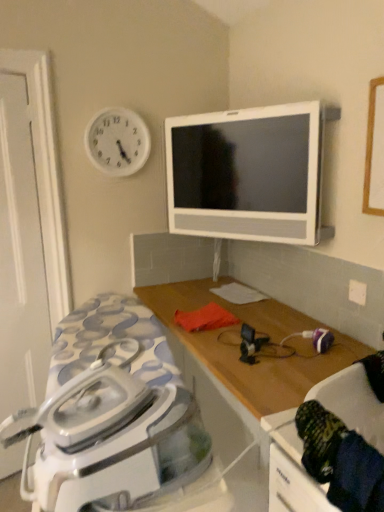
What do you see at coordinates (247, 173) in the screenshot? The image size is (384, 512). I see `white glossy television at upper center` at bounding box center [247, 173].

Measure the distance between white plastic clock at upper left and camera.

7.05 feet.

Image resolution: width=384 pixels, height=512 pixels. I want to click on white plastic clock at upper left, so click(x=117, y=142).

Where is `white matte door at left`? The height and width of the screenshot is (512, 384). white matte door at left is located at coordinates (25, 228).

Image resolution: width=384 pixels, height=512 pixels. What are the coordinates of `white glossy television at upper center` in the screenshot? It's located at (247, 173).

Is white matte door at left completely or partially inside wooden table at center?

No.

Is wooden table at center wider than white matte door at left?

Yes, wooden table at center is wider than white matte door at left.

Is wooden table at center positioned in front of white matte door at left?

Yes, the depth of wooden table at center is less than that of white matte door at left.

From the image's perspective, is wooden table at center positioned above or below white matte door at left?

wooden table at center is below white matte door at left.

This screenshot has height=512, width=384. In order to click on home appliance behind the dark blue fabric swivel chair at lower right in this screenshot , I will do `click(116, 421)`.

From the picture: Which of these two, white glossy iron at lower left or dark blue fabric swivel chair at lower right, stands shorter?

With less height is dark blue fabric swivel chair at lower right.

Is white glossy iron at lower left with dark blue fabric swivel chair at lower right?

They are not placed beside each other.

Considering the sizes of objects white glossy iron at lower left and dark blue fabric swivel chair at lower right in the image provided, who is thinner, white glossy iron at lower left or dark blue fabric swivel chair at lower right?

dark blue fabric swivel chair at lower right.

In the scene shown: Which object is positioned more to the left, white glossy iron at lower left or white glossy television at upper center?

white glossy iron at lower left.

Consider the image. Considering the sizes of objects white glossy iron at lower left and white glossy television at upper center in the image provided, who is taller, white glossy iron at lower left or white glossy television at upper center?

With more height is white glossy television at upper center.

Is point (202, 465) farther from viewer compared to point (258, 152)?

No, (202, 465) is closer to viewer.

Between dark blue fabric swivel chair at lower right and white matte door at left, which one appears on the left side from the viewer's perspective?

white matte door at left.

From a real-world perspective, relative to white matte door at left, is dark blue fabric swivel chair at lower right vertically above or below?

Clearly, from a real-world perspective, dark blue fabric swivel chair at lower right is below white matte door at left.

Who is bigger, dark blue fabric swivel chair at lower right or white matte door at left?

white matte door at left.

From the image's perspective, which is above, dark blue fabric swivel chair at lower right or white matte door at left?

white matte door at left, from the image's perspective.

Is the surface of white glossy iron at lower left in direct contact with wooden table at center?

No.

Based on the photo, from the image's perspective, which is above, white glossy iron at lower left or wooden table at center?

white glossy iron at lower left appears higher in the image.

I want to click on home appliance lying above the wooden table at center (from the image's perspective), so pos(116,421).

Is white glossy iron at lower left turned away from wooden table at center?

No, white glossy iron at lower left is not facing away from wooden table at center.

Can you confirm if wooden table at center is bigger than white plastic clock at upper left?

Correct, wooden table at center is larger in size than white plastic clock at upper left.

Is wooden table at center closer to camera compared to white plastic clock at upper left?

Yes, the depth of wooden table at center is less than that of white plastic clock at upper left.

Is wooden table at center inside the boundaries of white plastic clock at upper left, or outside?

wooden table at center is not enclosed by white plastic clock at upper left.

Are white plastic clock at upper left and white glossy television at upper center making contact?

No, white plastic clock at upper left is not beside white glossy television at upper center.

Which of these two, white plastic clock at upper left or white glossy television at upper center, is wider?

white glossy television at upper center is wider.

Can you confirm if white plastic clock at upper left is positioned to the left of white glossy television at upper center?

Yes.

Based on the photo, considering the sizes of objects white plastic clock at upper left and white glossy television at upper center in the image provided, who is bigger, white plastic clock at upper left or white glossy television at upper center?

white glossy television at upper center is bigger.

The height and width of the screenshot is (512, 384). Identify the location of door on the left of wooden table at center. (25, 228).

You are a GUI agent. You are given a task and a screenshot of the screen. Output one action in this format:
    pyautogui.click(x=<x>, y=<y>)
    Task: Click on the swivel chair on the right of white glossy iron at lower left
    The height and width of the screenshot is (512, 384).
    Given the screenshot: What is the action you would take?
    pyautogui.click(x=331, y=445)

Considering their positions, is dark blue fabric swivel chair at lower right positioned closer to wooden table at center than white matte door at left?

Among the two, dark blue fabric swivel chair at lower right is located nearer to wooden table at center.

Looking at the image, which one is located closer to dark blue fabric swivel chair at lower right, white glossy iron at lower left or white plastic clock at upper left?

white glossy iron at lower left lies closer to dark blue fabric swivel chair at lower right than the other object.

Considering their positions, is dark blue fabric swivel chair at lower right positioned further to white matte door at left than wooden table at center?

Among the two, dark blue fabric swivel chair at lower right is located further to white matte door at left.

Considering their positions, is white glossy iron at lower left positioned further to white glossy television at upper center than dark blue fabric swivel chair at lower right?

Based on the image, dark blue fabric swivel chair at lower right appears to be further to white glossy television at upper center.

From the image, which object appears to be farther from dark blue fabric swivel chair at lower right, white matte door at left or wooden table at center?

white matte door at left.

Based on their spatial positions, is white plastic clock at upper left or dark blue fabric swivel chair at lower right closer to white matte door at left?

white plastic clock at upper left.

Looking at this image, looking at the image, which one is located closer to wooden table at center, white matte door at left or dark blue fabric swivel chair at lower right?

dark blue fabric swivel chair at lower right.

Based on their spatial positions, is dark blue fabric swivel chair at lower right or wooden table at center closer to white glossy television at upper center?

Based on the image, wooden table at center appears to be nearer to white glossy television at upper center.

Where is `table between white glossy iron at lower left and white plastic clock at upper left from front to back`? The image size is (384, 512). table between white glossy iron at lower left and white plastic clock at upper left from front to back is located at coordinates (242, 362).

Where is `swivel chair between white glossy television at upper center and wooden table at center in the vertical direction`? Image resolution: width=384 pixels, height=512 pixels. swivel chair between white glossy television at upper center and wooden table at center in the vertical direction is located at coordinates [x=331, y=445].

Locate an element on the screen. home appliance located between white matte door at left and white glossy television at upper center in the left-right direction is located at coordinates (116, 421).

In order to click on door located between white glossy iron at lower left and white plastic clock at upper left in the depth direction in this screenshot , I will do `click(25, 228)`.